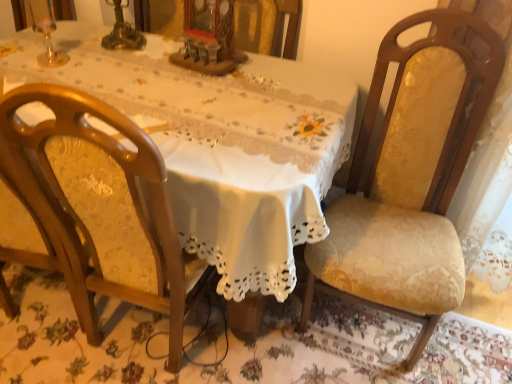
Identify the location of white lace tablecloth at center. (222, 145).

Image resolution: width=512 pixels, height=384 pixels. Describe the element at coordinates (222, 145) in the screenshot. I see `white lace tablecloth at center` at that location.

Locate an element on the screen. This screenshot has width=512, height=384. velvet yellow chair at right, marked as the 1th chair in a right-to-left arrangement is located at coordinates (411, 176).

Is velvet yellow chair at right, marked as the 1th chair in a right-to-left arrangement, facing towards white lace tablecloth at center?

No, velvet yellow chair at right, marked as the 1th chair in a right-to-left arrangement, is not turned towards white lace tablecloth at center.

Is velvet yellow chair at right, the second chair from the left, shorter than white lace tablecloth at center?

No, velvet yellow chair at right, the second chair from the left, is not shorter than white lace tablecloth at center.

Is velvet yellow chair at right, marked as the 1th chair in a right-to-left arrangement, in front of or behind white lace tablecloth at center in the image?

velvet yellow chair at right, marked as the 1th chair in a right-to-left arrangement, is in front of white lace tablecloth at center.

Which object is thinner, velvet yellow chair at right, marked as the 1th chair in a right-to-left arrangement, or white lace tablecloth at center?

velvet yellow chair at right, marked as the 1th chair in a right-to-left arrangement, is thinner.

Locate an element on the screen. The width and height of the screenshot is (512, 384). table on the left side of velvet yellow chair at right, the second chair from the left is located at coordinates (222, 145).

From the image's perspective, which is below, white lace tablecloth at center or velvet yellow chair at right, the second chair from the left?

From the image's view, velvet yellow chair at right, the second chair from the left, is below.

Based on the photo, does white lace tablecloth at center come behind velvet yellow chair at right, marked as the 1th chair in a right-to-left arrangement?

Yes, it is.

From a real-world perspective, is white lace tablecloth at center physically above velvet yellow chair at right, marked as the 1th chair in a right-to-left arrangement?

No, from a real-world perspective, white lace tablecloth at center is not above velvet yellow chair at right, marked as the 1th chair in a right-to-left arrangement.

Considering the sizes of objects velvet yellow chair at right, the second chair from the left, and wooden chair at left, which ranks as the 2th chair in right-to-left order, in the image provided, who is taller, velvet yellow chair at right, the second chair from the left, or wooden chair at left, which ranks as the 2th chair in right-to-left order,?

Standing taller between the two is wooden chair at left, which ranks as the 2th chair in right-to-left order.

Could you tell me if velvet yellow chair at right, marked as the 1th chair in a right-to-left arrangement, is facing wooden chair at left, which ranks as the 2th chair in right-to-left order?

No, velvet yellow chair at right, marked as the 1th chair in a right-to-left arrangement, is not aimed at wooden chair at left, which ranks as the 2th chair in right-to-left order.

From the image's perspective, which object appears higher, velvet yellow chair at right, the second chair from the left, or wooden chair at left, which ranks as the 2th chair in right-to-left order?

velvet yellow chair at right, the second chair from the left.

From the picture: How different are the orientations of velvet yellow chair at right, marked as the 1th chair in a right-to-left arrangement, and wooden chair at left, acting as the 1th chair starting from the left, in degrees?

The angle between the facing direction of velvet yellow chair at right, marked as the 1th chair in a right-to-left arrangement, and the facing direction of wooden chair at left, acting as the 1th chair starting from the left, is 173 degrees.

Which of these two, wooden chair at left, which ranks as the 2th chair in right-to-left order, or velvet yellow chair at right, the second chair from the left, is thinner?

wooden chair at left, which ranks as the 2th chair in right-to-left order.

Considering the relative sizes of wooden chair at left, acting as the 1th chair starting from the left, and velvet yellow chair at right, marked as the 1th chair in a right-to-left arrangement, in the image provided, is wooden chair at left, acting as the 1th chair starting from the left, bigger than velvet yellow chair at right, marked as the 1th chair in a right-to-left arrangement,?

No, wooden chair at left, acting as the 1th chair starting from the left, is not bigger than velvet yellow chair at right, marked as the 1th chair in a right-to-left arrangement.

Which object is more forward, wooden chair at left, which ranks as the 2th chair in right-to-left order, or velvet yellow chair at right, the second chair from the left?

wooden chair at left, which ranks as the 2th chair in right-to-left order, is in front.

Considering the relative positions of wooden chair at left, acting as the 1th chair starting from the left, and velvet yellow chair at right, marked as the 1th chair in a right-to-left arrangement, in the image provided, is wooden chair at left, acting as the 1th chair starting from the left, to the left or to the right of velvet yellow chair at right, marked as the 1th chair in a right-to-left arrangement,?

In the image, wooden chair at left, acting as the 1th chair starting from the left, appears on the left side of velvet yellow chair at right, marked as the 1th chair in a right-to-left arrangement.

Is wooden chair at left, which ranks as the 2th chair in right-to-left order, facing away from white lace tablecloth at center?

That's right, wooden chair at left, which ranks as the 2th chair in right-to-left order, is facing away from white lace tablecloth at center.

The image size is (512, 384). I want to click on table lying above the wooden chair at left, acting as the 1th chair starting from the left (from the image's perspective), so [222, 145].

Does wooden chair at left, which ranks as the 2th chair in right-to-left order, have a smaller size compared to white lace tablecloth at center?

Yes, wooden chair at left, which ranks as the 2th chair in right-to-left order, is smaller than white lace tablecloth at center.

From the image's perspective, is white lace tablecloth at center below wooden chair at left, which ranks as the 2th chair in right-to-left order?

No, from the image's perspective, white lace tablecloth at center is not below wooden chair at left, which ranks as the 2th chair in right-to-left order.

In order to click on table below the wooden chair at left, acting as the 1th chair starting from the left (from a real-world perspective) in this screenshot , I will do `click(222, 145)`.

Would you consider white lace tablecloth at center to be distant from wooden chair at left, which ranks as the 2th chair in right-to-left order?

No, white lace tablecloth at center is in close proximity to wooden chair at left, which ranks as the 2th chair in right-to-left order.

Is white lace tablecloth at center at the left side of wooden chair at left, which ranks as the 2th chair in right-to-left order?

Yes.

Image resolution: width=512 pixels, height=384 pixels. Find the location of `table below the velvet yellow chair at right, marked as the 1th chair in a right-to-left arrangement (from a real-world perspective)`. table below the velvet yellow chair at right, marked as the 1th chair in a right-to-left arrangement (from a real-world perspective) is located at coordinates (222, 145).

At what (x,y) coordinates should I click in order to perform the action: click on the 2nd chair positioned above the white lace tablecloth at center (from a real-world perspective). Please return your answer as a coordinate pair (x, y). The width and height of the screenshot is (512, 384). Looking at the image, I should click on (411, 176).

Consider the image. From the image, which object appears to be nearer to velvet yellow chair at right, marked as the 1th chair in a right-to-left arrangement, white lace tablecloth at center or wooden chair at left, acting as the 1th chair starting from the left?

white lace tablecloth at center lies closer to velvet yellow chair at right, marked as the 1th chair in a right-to-left arrangement, than the other object.

Estimate the real-world distances between objects in this image. Which object is further from white lace tablecloth at center, velvet yellow chair at right, marked as the 1th chair in a right-to-left arrangement, or wooden chair at left, acting as the 1th chair starting from the left?

velvet yellow chair at right, marked as the 1th chair in a right-to-left arrangement, lies further to white lace tablecloth at center than the other object.

Based on their spatial positions, is white lace tablecloth at center or velvet yellow chair at right, marked as the 1th chair in a right-to-left arrangement, closer to wooden chair at left, acting as the 1th chair starting from the left?

The object closer to wooden chair at left, acting as the 1th chair starting from the left, is white lace tablecloth at center.

When comparing their distances from white lace tablecloth at center, does wooden chair at left, which ranks as the 2th chair in right-to-left order, or velvet yellow chair at right, the second chair from the left, seem closer?

wooden chair at left, which ranks as the 2th chair in right-to-left order, is closer to white lace tablecloth at center.

Considering their positions, is wooden chair at left, which ranks as the 2th chair in right-to-left order, positioned closer to velvet yellow chair at right, marked as the 1th chair in a right-to-left arrangement, than white lace tablecloth at center?

white lace tablecloth at center is closer to velvet yellow chair at right, marked as the 1th chair in a right-to-left arrangement.

From the picture: Considering their positions, is velvet yellow chair at right, marked as the 1th chair in a right-to-left arrangement, positioned closer to wooden chair at left, acting as the 1th chair starting from the left, than white lace tablecloth at center?

The object closer to wooden chair at left, acting as the 1th chair starting from the left, is white lace tablecloth at center.

Locate an element on the screen. chair located between white lace tablecloth at center and velvet yellow chair at right, the second chair from the left, in the left-right direction is located at coordinates (98, 210).